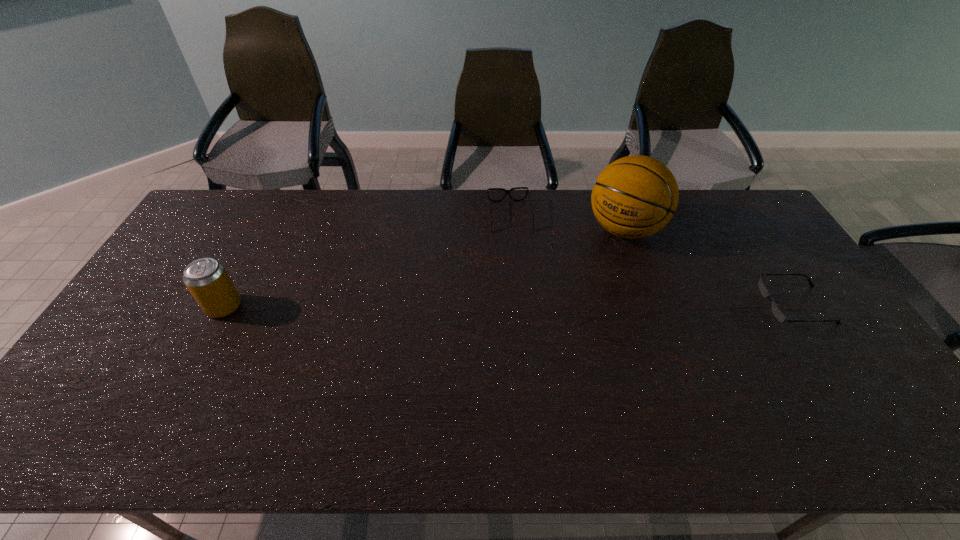
You are a GUI agent. You are given a task and a screenshot of the screen. Output one action in this format:
    pyautogui.click(x=<x>, y=<y>)
    Task: Click on the vacant space situated 0.060m on the front-facing side of the right spectacles
    The height and width of the screenshot is (540, 960).
    Given the screenshot: What is the action you would take?
    pyautogui.click(x=743, y=305)

Identify the location of vacant space located 0.150m on the front-facing side of the right spectacles. (712, 305).

Image resolution: width=960 pixels, height=540 pixels. What are the coordinates of `vacant space situated with the lenses facing outward on the second object from left to right` in the screenshot? It's located at (517, 264).

This screenshot has height=540, width=960. Identify the location of vacant space located 0.190m with the lenses facing outward on the second object from left to right. (519, 273).

The image size is (960, 540). What are the coordinates of `free space located with the lenses facing outward on the second object from left to right` in the screenshot? It's located at [x=516, y=252].

Image resolution: width=960 pixels, height=540 pixels. I want to click on free space located on the surface of the tallest object near the brand logo, so click(x=569, y=299).

What are the coordinates of `vacant space located 0.120m on the surface of the tallest object near the brand logo` in the screenshot? It's located at (590, 271).

What are the coordinates of `free space located 0.360m on the surface of the tallest object near the brand logo` in the screenshot? It's located at (552, 320).

Find the location of a particular element. The height and width of the screenshot is (540, 960). spectacles situated at the far edge is located at coordinates (506, 191).

You are a GUI agent. You are given a task and a screenshot of the screen. Output one action in this format:
    pyautogui.click(x=<x>, y=<y>)
    Task: Click on the basketball that is at the far edge
    This screenshot has width=960, height=540.
    Given the screenshot: What is the action you would take?
    pyautogui.click(x=635, y=196)